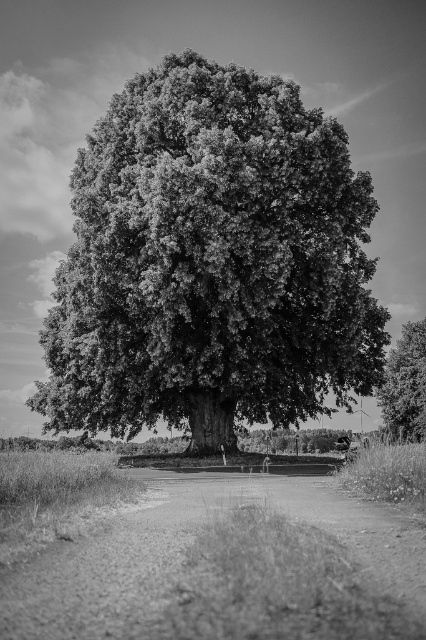
You are a landscape architect planning to install a small garden between the smooth bark oak tree at center and the dark green textured tree at right. What is the minimum width of the garden path required to fit between them?

The smooth bark oak tree at center is 13.96 meters from the dark green textured tree at right, so the minimum width of the garden path should be at least 13.96 meters to fit between them.

Looking at this image, you are standing on the paved path in the foreground of the scene. You see a point marked at coordinates (212, 262). Which object does this point correspond to?

The point at coordinates (212, 262) corresponds to the smooth bark oak tree at center.